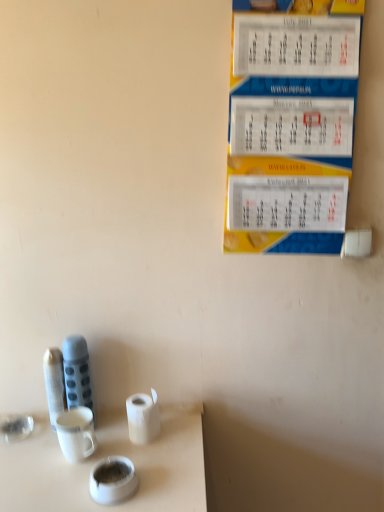
Question: Considering the relative sizes of yellow paper calendar at upper right and white glossy teacup at lower center in the image provided, is yellow paper calendar at upper right thinner than white glossy teacup at lower center?

Choices:
 (A) yes
 (B) no

Answer: (A)

Question: Is yellow paper calendar at upper right smaller than white glossy teacup at lower center?

Choices:
 (A) yes
 (B) no

Answer: (B)

Question: Could you tell me if yellow paper calendar at upper right is turned towards white glossy teacup at lower center?

Choices:
 (A) no
 (B) yes

Answer: (A)

Question: Is yellow paper calendar at upper right beside white glossy teacup at lower center?

Choices:
 (A) yes
 (B) no

Answer: (B)

Question: Does yellow paper calendar at upper right appear on the right side of white glossy teacup at lower center?

Choices:
 (A) no
 (B) yes

Answer: (B)

Question: Considering the relative sizes of yellow paper calendar at upper right and white glossy teacup at lower center in the image provided, is yellow paper calendar at upper right shorter than white glossy teacup at lower center?

Choices:
 (A) yes
 (B) no

Answer: (B)

Question: Considering the relative sizes of matte gray thermos at left and yellow paper calendar at upper right in the image provided, is matte gray thermos at left thinner than yellow paper calendar at upper right?

Choices:
 (A) yes
 (B) no

Answer: (A)

Question: Considering the relative sizes of matte gray thermos at left and yellow paper calendar at upper right in the image provided, is matte gray thermos at left bigger than yellow paper calendar at upper right?

Choices:
 (A) no
 (B) yes

Answer: (A)

Question: Is matte gray thermos at left closer to the viewer compared to yellow paper calendar at upper right?

Choices:
 (A) no
 (B) yes

Answer: (A)

Question: From the image's perspective, is matte gray thermos at left over yellow paper calendar at upper right?

Choices:
 (A) no
 (B) yes

Answer: (A)

Question: Is matte gray thermos at left positioned far away from yellow paper calendar at upper right?

Choices:
 (A) yes
 (B) no

Answer: (B)

Question: Is matte gray thermos at left not inside yellow paper calendar at upper right?

Choices:
 (A) no
 (B) yes

Answer: (B)

Question: Are white matte toilet paper at lower center and matte gray thermos at left far apart?

Choices:
 (A) yes
 (B) no

Answer: (B)